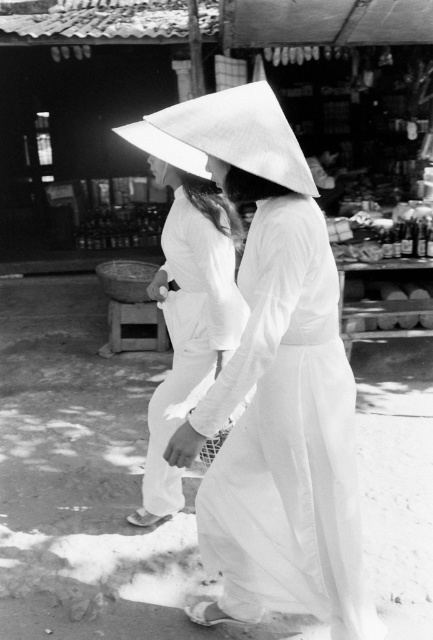
Is white cotton dress at center positioned in front of white matte ao dai at center?

Yes, it is.

Who is shorter, white cotton dress at center or white matte ao dai at center?

white cotton dress at center

Is point (271, 237) behind point (151, 467)?

No, it is in front of (151, 467).

Find the location of `white cotton dress at center`. white cotton dress at center is located at coordinates (287, 438).

Is point (232, 252) positioned before point (261, 163)?

No, it is behind (261, 163).

Which of these two, white matte ao dai at center or white paper umbrella at center, stands taller?

With more height is white matte ao dai at center.

The width and height of the screenshot is (433, 640). What do you see at coordinates (188, 321) in the screenshot?
I see `white matte ao dai at center` at bounding box center [188, 321].

Where is `white matte ao dai at center`? Image resolution: width=433 pixels, height=640 pixels. white matte ao dai at center is located at coordinates (188, 321).

You are a GUI agent. You are given a task and a screenshot of the screen. Output one action in this format:
    pyautogui.click(x=<x>, y=<y>)
    Task: Click on the white cotton dress at center
    
    Given the screenshot: What is the action you would take?
    pyautogui.click(x=287, y=438)

Between point (287, 547) and point (299, 177), which one is positioned in front?

Point (299, 177) is in front.

Between point (307, 481) and point (245, 147), which one is positioned behind?

Point (307, 481)

I want to click on white cotton dress at center, so click(287, 438).